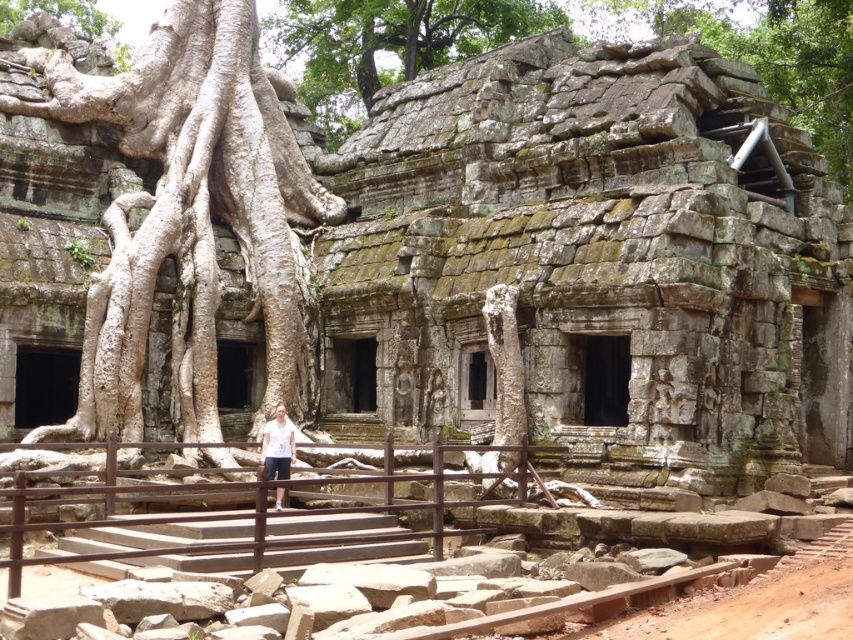
Does white rough bark tree at center have a larger size compared to green mossy stone wall at upper center?

Indeed, white rough bark tree at center has a larger size compared to green mossy stone wall at upper center.

Is white rough bark tree at center wider than green mossy stone wall at upper center?

Incorrect, white rough bark tree at center's width does not surpass green mossy stone wall at upper center's.

Between point (178, 10) and point (431, 1), which one is positioned behind?

Point (431, 1)

Find the location of a particular element. Image resolution: width=853 pixels, height=640 pixels. white rough bark tree at center is located at coordinates 190,216.

Is green mossy stone wall at upper center shorter than white cotton shirt at center?

In fact, green mossy stone wall at upper center may be taller than white cotton shirt at center.

Between green mossy stone wall at upper center and white cotton shirt at center, which one appears on the left side from the viewer's perspective?

white cotton shirt at center is more to the left.

Who is more distant from viewer, (363, 0) or (270, 433)?

The point (363, 0) is more distant.

Find the location of a particular element. green mossy stone wall at upper center is located at coordinates (387, 44).

Between point (267, 358) and point (287, 426), which one is positioned in front?

Point (287, 426) is in front.

Does white rough bark tree at center appear over white cotton shirt at center?

Yes, white rough bark tree at center is above white cotton shirt at center.

Is point (183, 3) more distant than point (281, 468)?

Yes.

You are a GUI agent. You are given a task and a screenshot of the screen. Output one action in this format:
    pyautogui.click(x=<x>, y=<y>)
    Task: Click on the white rough bark tree at center
    
    Given the screenshot: What is the action you would take?
    pyautogui.click(x=190, y=216)